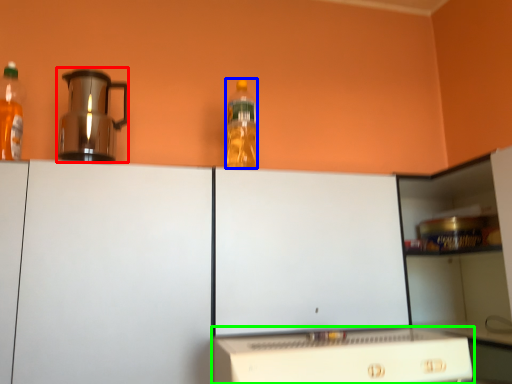
Question: Which object is the closest to the kitchen appliance (highlighted by a red box)? Choose among these: bottle (highlighted by a blue box) or home appliance (highlighted by a green box).

Choices:
 (A) bottle
 (B) home appliance

Answer: (A)